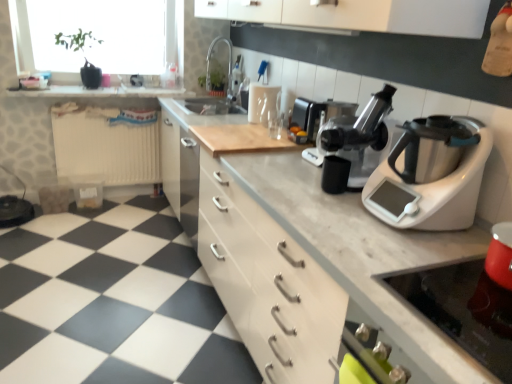
At what (x,y) coordinates should I click in order to perform the action: click on vacant area on top of white plastic radiator at lower left (from a real-world perspective). Please return your answer as a coordinate pair (x, y). The image size is (512, 384). Looking at the image, I should click on (126, 103).